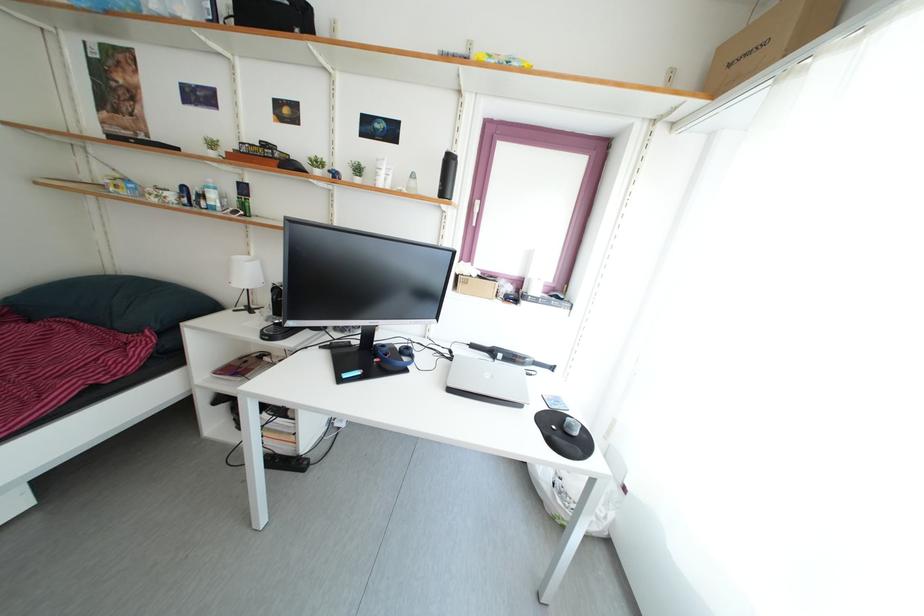
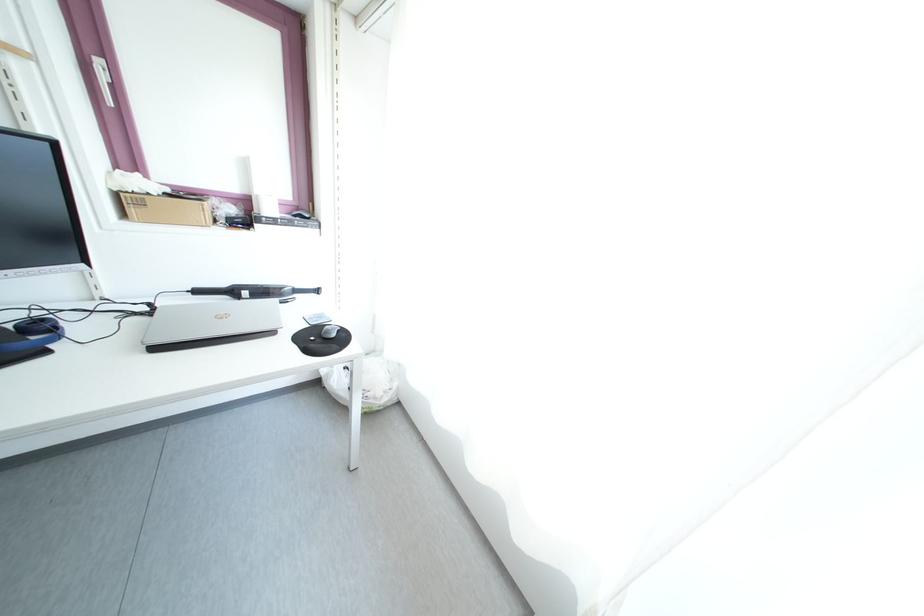
The point at (565,408) is marked in the first image. Where is the corresponding point in the second image?

(327, 323)